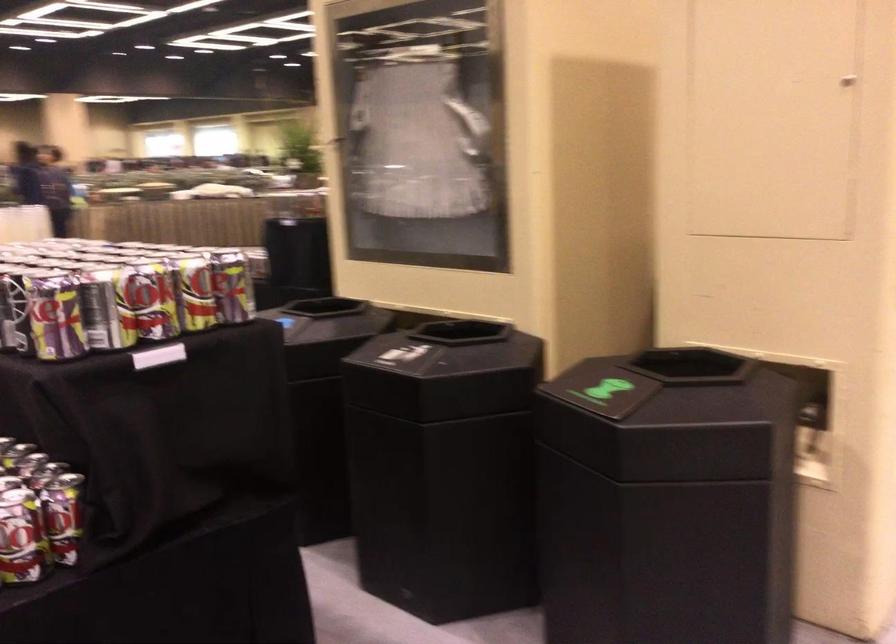
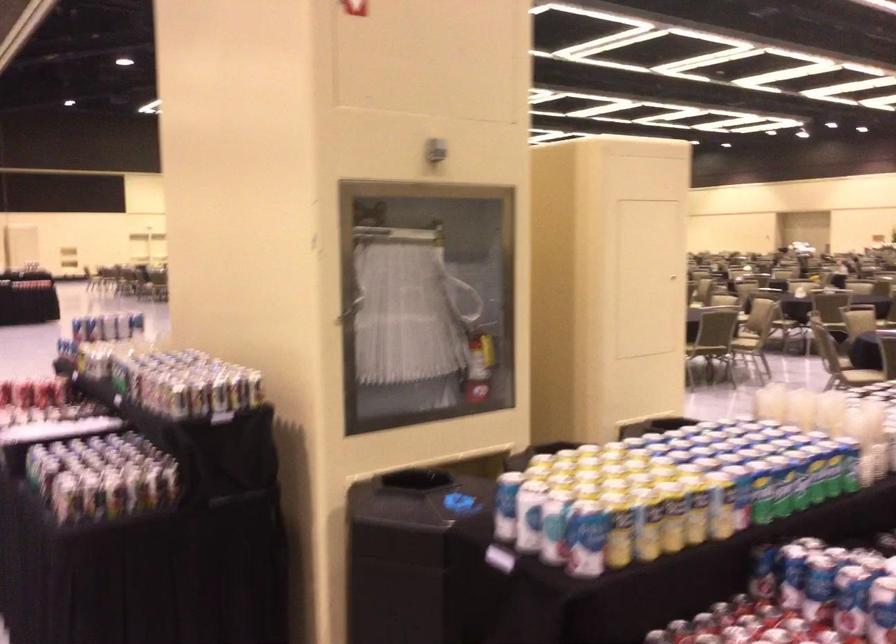
Find the pixel in the second image that matches point (298, 324) in the first image.

(442, 502)